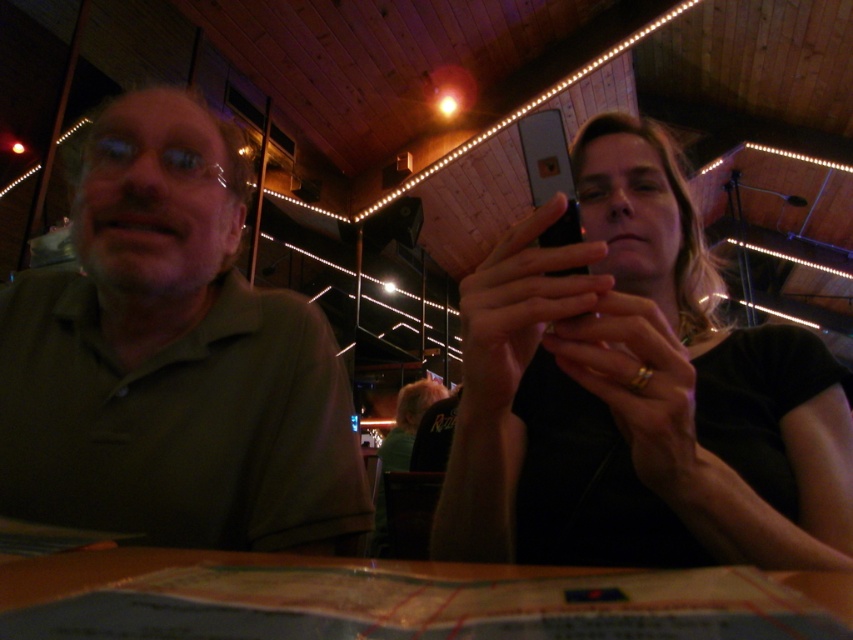
You are a photographer trying to capture a candid shot of the scene. You want to focus on the green matte shirt at left and the black matte phone at upper right. Which object should you adjust your camera focus on first if you want to ensure both are in focus?

The black matte phone at upper right is closer to the viewer than the green matte shirt at left. To ensure both are in focus, you should adjust your camera focus on the closer object first, which is the black matte phone at upper right.

You are a customer at the restaurant and want to place your black matte phone at upper right on the table. Can you estimate where on the table to place it so that it aligns with the coordinate given in the description?

The black matte phone at upper right should be placed at the coordinate point (637, 394) on the table to align with the description.

You are a customer in this restaurant and want to place your phone on the table without blocking the menu. The menu is placed on the table near the edge closest to you. Where should you place your black matte phone at upper right relative to the green matte shirt at left to ensure it doesn,t block the menu?

Place the black matte phone at upper right to the right of the green matte shirt at left to keep it from blocking the menu, as the menu is near the edge closest to you and the phone is positioned to the right side of the shirt.